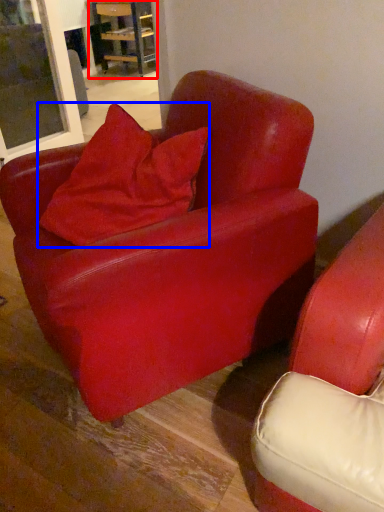
Question: Which object appears farthest to the camera in this image, table (highlighted by a red box) or pillow (highlighted by a blue box)?

Choices:
 (A) table
 (B) pillow

Answer: (A)